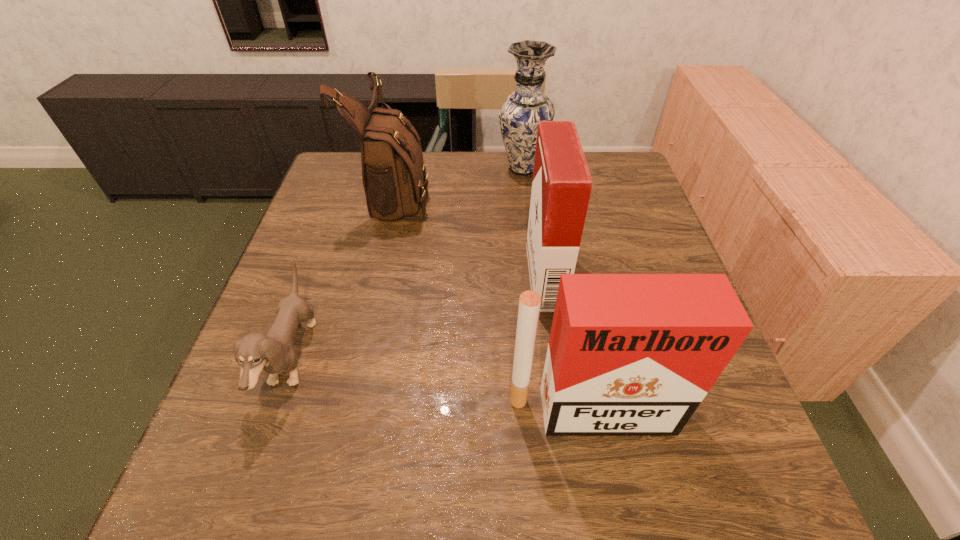
Identify the location of shoulder bag. The width and height of the screenshot is (960, 540). (394, 176).

This screenshot has height=540, width=960. I want to click on vase, so click(521, 111).

Locate an element on the screen. The image size is (960, 540). the farther cigarette case is located at coordinates (561, 187).

What are the coordinates of `the nearer cigarette case` in the screenshot? It's located at (629, 354).

I want to click on puppy, so click(x=273, y=353).

The width and height of the screenshot is (960, 540). Identify the location of free space located 0.190m on the front-facing side of the shoulder bag. (499, 193).

Where is `free space located 0.120m on the right of the vase`? free space located 0.120m on the right of the vase is located at coordinates (589, 168).

Locate an element on the screen. This screenshot has width=960, height=540. vacant region located on the front-facing side of the farther cigarette case is located at coordinates (370, 276).

I want to click on free point located on the front-facing side of the farther cigarette case, so click(498, 276).

You are a GUI agent. You are given a task and a screenshot of the screen. Output one action in this format:
    pyautogui.click(x=<x>, y=<y>)
    Task: Click on the blank area located 0.320m on the front-facing side of the farther cigarette case
    Image resolution: width=960 pixels, height=540 pixels.
    Given the screenshot: What is the action you would take?
    pyautogui.click(x=387, y=276)